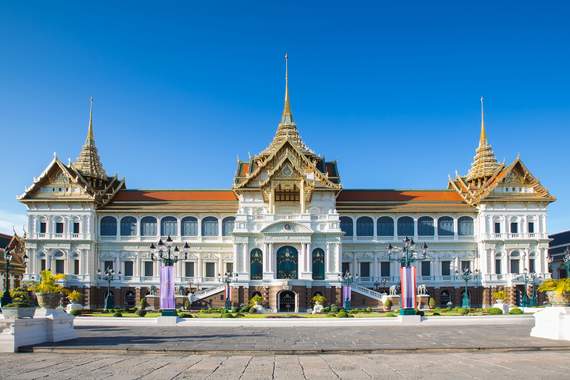
Identify the location of stairs. The height and width of the screenshot is (380, 570). (211, 285), (366, 287).